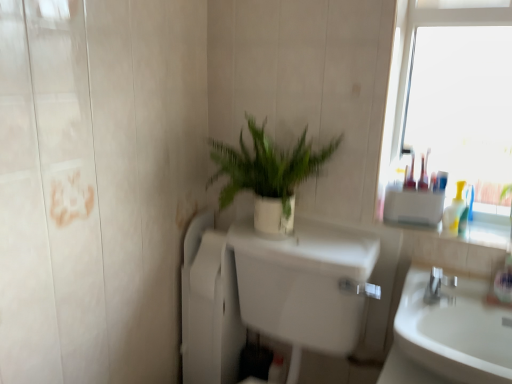
Question: Should I look upward or downward to see translucent plastic bottles at right?

Choices:
 (A) down
 (B) up

Answer: (A)

Question: Can you confirm if white matte plant pot at center is taller than white glossy sink at lower right?

Choices:
 (A) no
 (B) yes

Answer: (B)

Question: Is white matte plant pot at center wider than white glossy sink at lower right?

Choices:
 (A) no
 (B) yes

Answer: (A)

Question: Is white matte plant pot at center outside white glossy sink at lower right?

Choices:
 (A) yes
 (B) no

Answer: (A)

Question: Is white matte plant pot at center positioned with its back to white glossy sink at lower right?

Choices:
 (A) no
 (B) yes

Answer: (A)

Question: From a real-world perspective, is white matte plant pot at center positioned under white glossy sink at lower right based on gravity?

Choices:
 (A) no
 (B) yes

Answer: (A)

Question: From the image's perspective, is white matte plant pot at center beneath white glossy sink at lower right?

Choices:
 (A) yes
 (B) no

Answer: (B)

Question: Is white glossy toilet at center at the right side of silver metallic faucet at right?

Choices:
 (A) no
 (B) yes

Answer: (A)

Question: From a real-world perspective, is white glossy toilet at center beneath silver metallic faucet at right?

Choices:
 (A) yes
 (B) no

Answer: (A)

Question: Does white glossy toilet at center come in front of silver metallic faucet at right?

Choices:
 (A) no
 (B) yes

Answer: (B)

Question: Is white glossy toilet at center beside silver metallic faucet at right?

Choices:
 (A) no
 (B) yes

Answer: (A)

Question: Can you confirm if white glossy toilet at center is wider than silver metallic faucet at right?

Choices:
 (A) yes
 (B) no

Answer: (A)

Question: Does white glossy toilet at center come behind silver metallic faucet at right?

Choices:
 (A) yes
 (B) no

Answer: (B)

Question: Does white matte plant pot at center turn towards translucent plastic bottles at right?

Choices:
 (A) yes
 (B) no

Answer: (B)